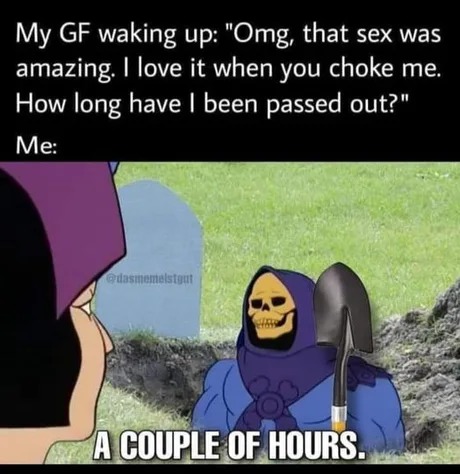
At what (x,y) coordinates should I click in order to perform the action: click on wooden handle. Please return your answer as a coordinate pair (x, y). Looking at the image, I should click on (336, 427).